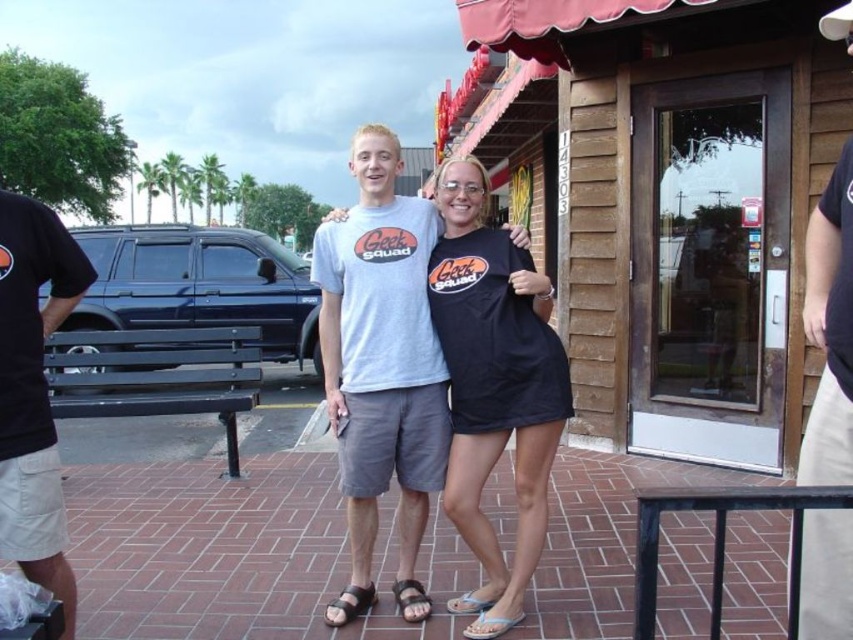
Question: Which of the following is the closest to the observer?

Choices:
 (A) black cotton shirt at center
 (B) brown leather sandal at lower center
 (C) light blue fabric sandal at center
 (D) black cotton dress at center

Answer: (A)

Question: Does light brown leather sandal at lower center have a larger size compared to light blue fabric sandal at center?

Choices:
 (A) no
 (B) yes

Answer: (A)

Question: Considering the real-world distances, which object is closest to the brown leather sandal at center?

Choices:
 (A) black cotton shirt at center
 (B) brick pavement at center
 (C) light brown leather sandal at lower center

Answer: (C)

Question: Considering the relative positions of black cotton shirt at center and brown leather sandal at lower center in the image provided, where is black cotton shirt at center located with respect to brown leather sandal at lower center?

Choices:
 (A) below
 (B) above

Answer: (B)

Question: Can you confirm if brick pavement at center is positioned above black cotton t-shirt at left?

Choices:
 (A) yes
 (B) no

Answer: (B)

Question: Estimate the real-world distances between objects in this image. Which object is closer to the brown leather sandal at lower center?

Choices:
 (A) light blue fabric sandal at center
 (B) black cotton shirt at center
 (C) black cotton t-shirt at left

Answer: (A)